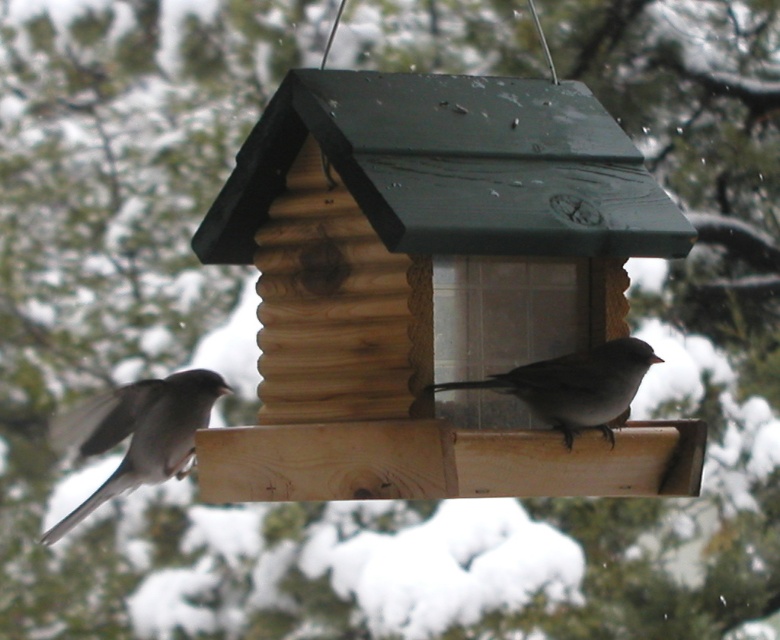
Question: Is gray matte sparrow at left wider than gray matte sparrow at center?

Choices:
 (A) no
 (B) yes

Answer: (A)

Question: Which point is farther to the camera?

Choices:
 (A) gray matte sparrow at center
 (B) gray matte sparrow at left

Answer: (B)

Question: Can you confirm if gray matte sparrow at left is bigger than gray matte sparrow at center?

Choices:
 (A) yes
 (B) no

Answer: (A)

Question: Does gray matte sparrow at left appear on the right side of gray matte sparrow at center?

Choices:
 (A) no
 (B) yes

Answer: (A)

Question: Among these objects, which one is farthest from the camera?

Choices:
 (A) gray matte sparrow at left
 (B) gray matte sparrow at center

Answer: (A)